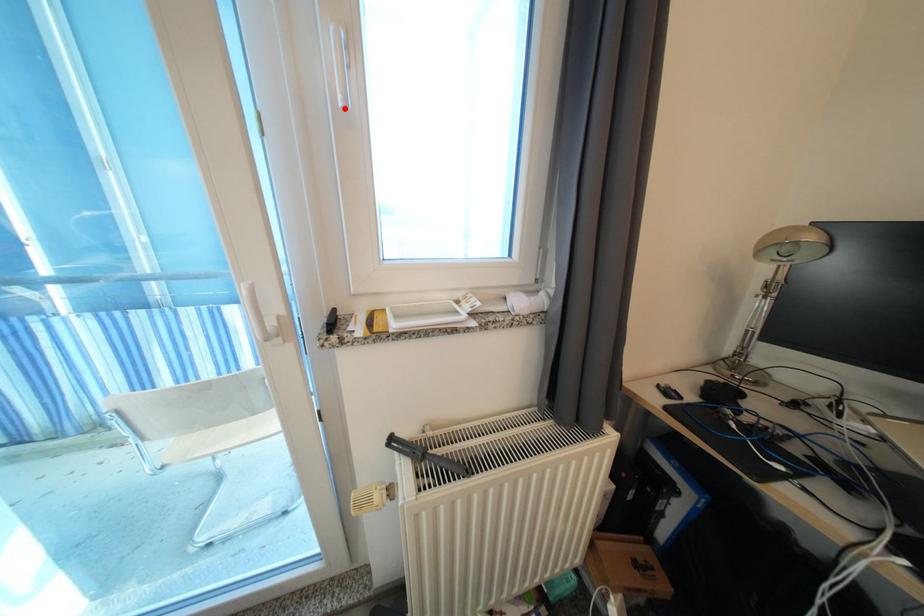
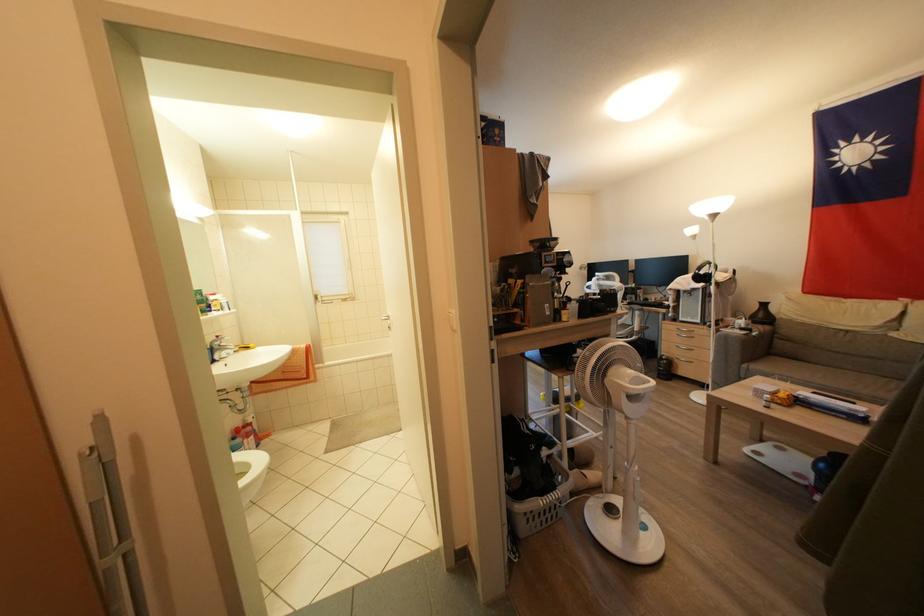
Question: I am providing you with two images of the same scene from different viewpoints. A red point is marked on the first image. Is the red point's position out of view in image 2?

Choices:
 (A) Yes
 (B) No

Answer: (A)